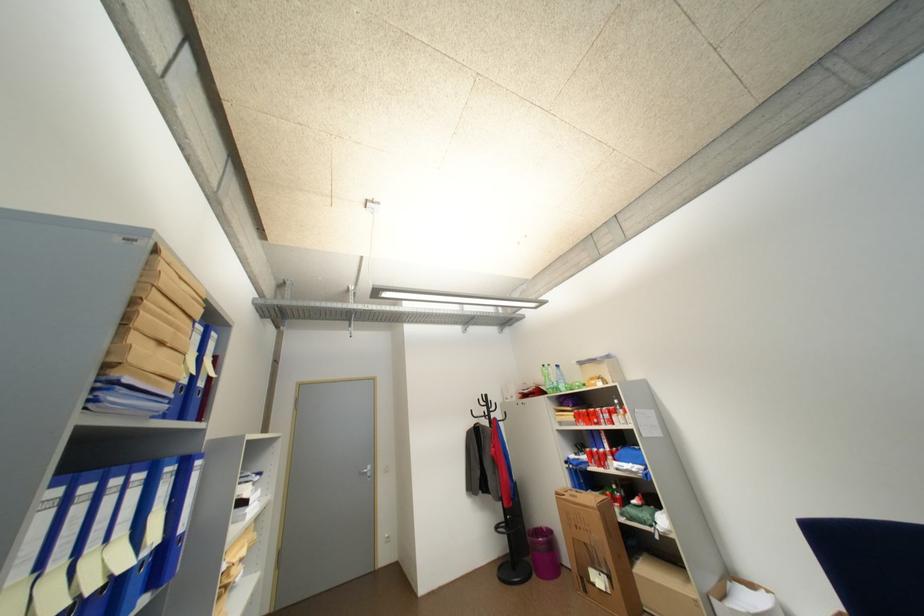
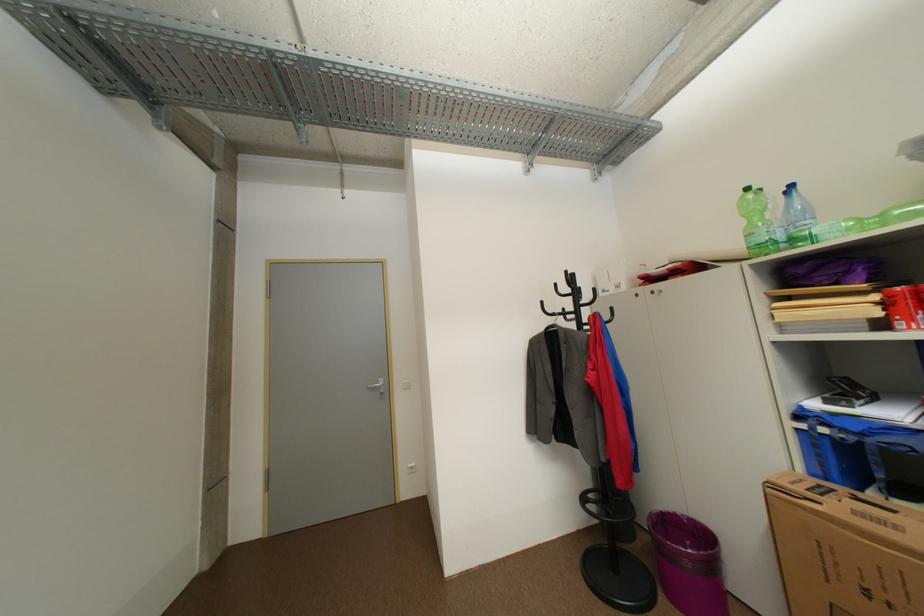
Question: What movement of the cameraman would produce the second image?

Choices:
 (A) Left
 (B) Right
 (C) Forward
 (D) Backward

Answer: (C)